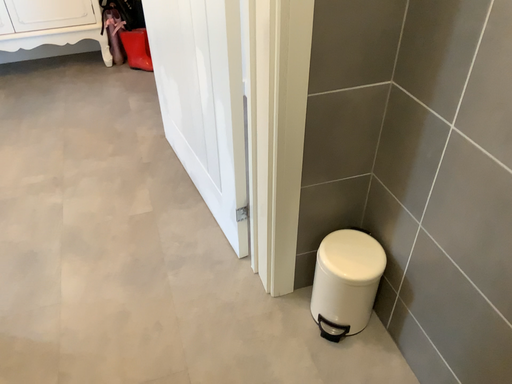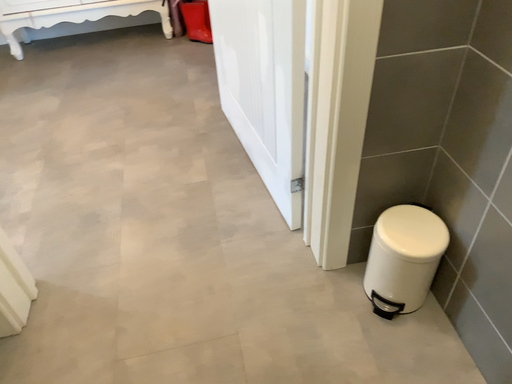
Question: Which way did the camera rotate in the video?

Choices:
 (A) rotated left
 (B) rotated right

Answer: (A)